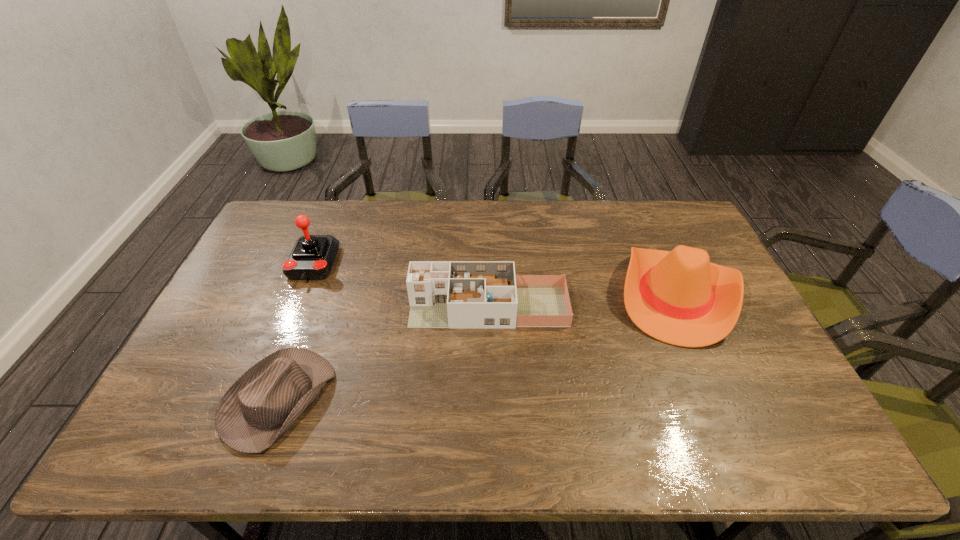
Where is `free space that satisfies the following two spatial constraints: 1. on the base of the rightmost object; 2. on the right side of the joystick`? free space that satisfies the following two spatial constraints: 1. on the base of the rightmost object; 2. on the right side of the joystick is located at coordinates (300, 295).

At what (x,y) coordinates should I click in order to perform the action: click on free space in the image that satisfies the following two spatial constraints: 1. on the base of the joystick; 2. on the right side of the nearest object. Please return your answer as a coordinate pair (x, y). Looking at the image, I should click on pyautogui.click(x=259, y=399).

Where is `free space that satisfies the following two spatial constraints: 1. on the base of the joystick; 2. on the right side of the fedora`? The image size is (960, 540). free space that satisfies the following two spatial constraints: 1. on the base of the joystick; 2. on the right side of the fedora is located at coordinates (259, 399).